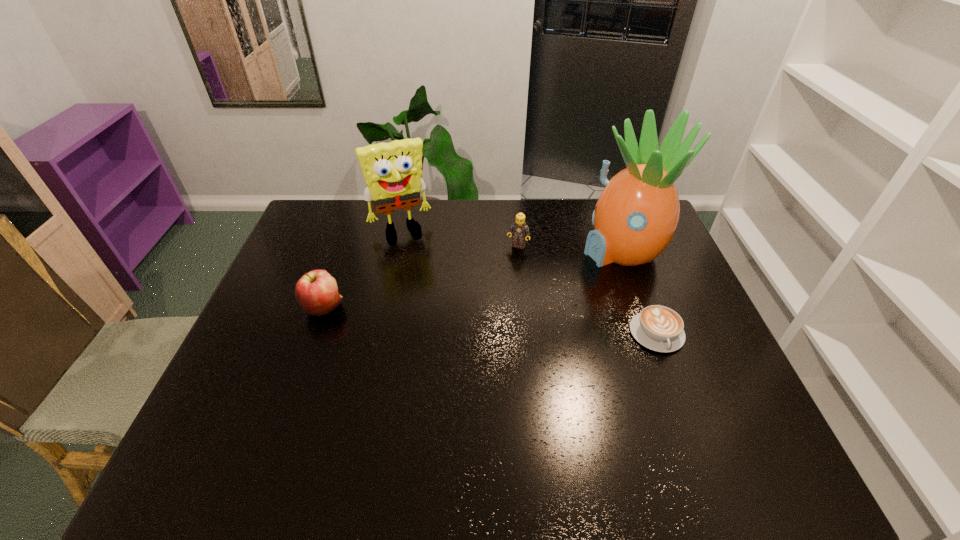
In order to click on vacant space that's between the leftmost object and the pineapple in this screenshot , I will do `click(473, 279)`.

This screenshot has height=540, width=960. I want to click on free space between the third object from right to left and the apple, so click(x=420, y=276).

Find the location of a particular element. This screenshot has width=960, height=540. unoccupied area between the pineapple and the third object from right to left is located at coordinates (570, 248).

Locate an element on the screen. This screenshot has width=960, height=540. vacant area that lies between the pineapple and the leftmost object is located at coordinates (473, 279).

This screenshot has width=960, height=540. I want to click on vacant space that's between the second tallest object and the apple, so click(x=362, y=268).

At what (x,y) coordinates should I click in order to perform the action: click on free area in between the cappuccino and the Lego. Please return your answer as a coordinate pair (x, y). The height and width of the screenshot is (540, 960). Looking at the image, I should click on (588, 289).

This screenshot has height=540, width=960. In order to click on free space between the cappuccino and the pineapple in this screenshot , I will do `click(639, 292)`.

Where is `free space between the cappuccino and the leftmost object`? This screenshot has height=540, width=960. free space between the cappuccino and the leftmost object is located at coordinates [x=491, y=321].

Image resolution: width=960 pixels, height=540 pixels. In order to click on the fourth closest object to the second tallest object in this screenshot , I will do `click(659, 328)`.

The height and width of the screenshot is (540, 960). I want to click on object that stands as the second closest to the third object from right to left, so click(x=392, y=171).